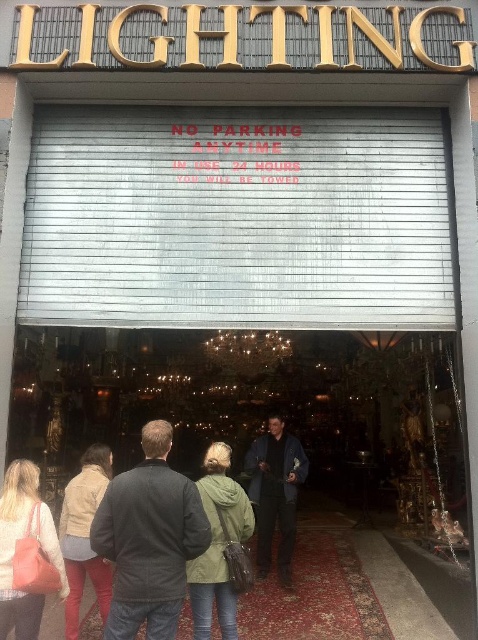
Can you confirm if navy blue jacket at center is bigger than matte beige jacket at lower left?

Indeed, navy blue jacket at center has a larger size compared to matte beige jacket at lower left.

Which is more to the right, navy blue jacket at center or matte beige jacket at lower left?

Positioned to the right is navy blue jacket at center.

The width and height of the screenshot is (478, 640). I want to click on navy blue jacket at center, so click(275, 493).

Based on the photo, measure the distance between dark gray jacket at center and camera.

dark gray jacket at center and camera are 3.39 meters apart from each other.

Who is positioned more to the left, dark gray jacket at center or matte beige jacket at lower left?

Positioned to the left is matte beige jacket at lower left.

Image resolution: width=478 pixels, height=640 pixels. What do you see at coordinates (149, 540) in the screenshot?
I see `dark gray jacket at center` at bounding box center [149, 540].

Find the location of a particular element. dark gray jacket at center is located at coordinates (149, 540).

Is matte pink purse at lower left above navy blue jacket at center?

Yes.

Who is positioned more to the right, matte pink purse at lower left or navy blue jacket at center?

From the viewer's perspective, navy blue jacket at center appears more on the right side.

At what (x,y) coordinates should I click in order to perform the action: click on matte pink purse at lower left. Please return your answer as a coordinate pair (x, y). Looking at the image, I should click on (14, 548).

In order to click on matte pink purse at lower left in this screenshot , I will do `click(14, 548)`.